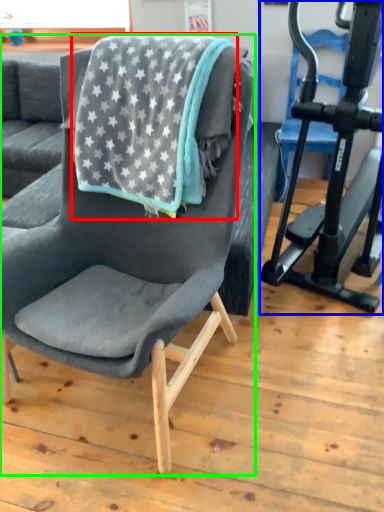
Question: Which is farther away from beach towel (highlighted by a red box)? stationary bicycle (highlighted by a blue box) or chair (highlighted by a green box)?

Choices:
 (A) stationary bicycle
 (B) chair

Answer: (A)